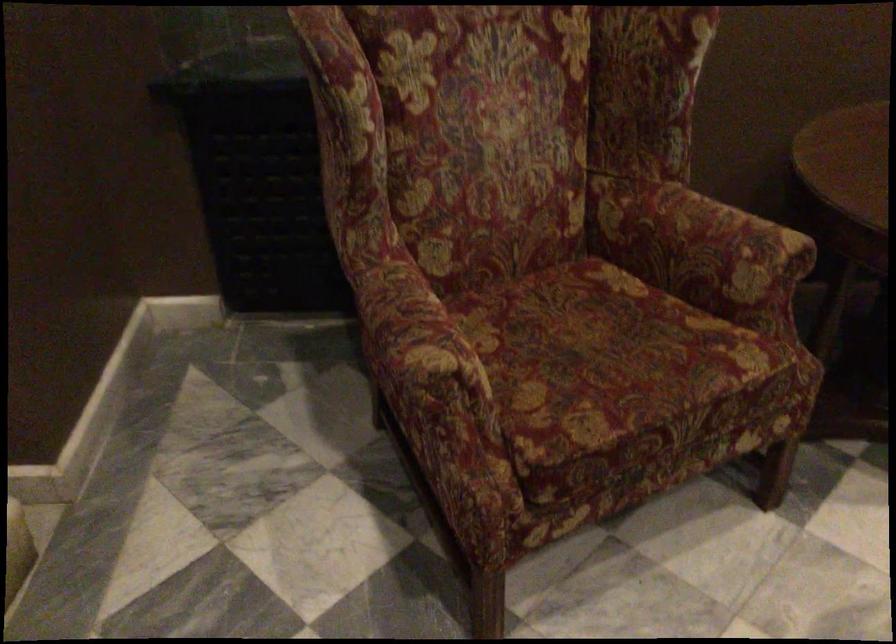
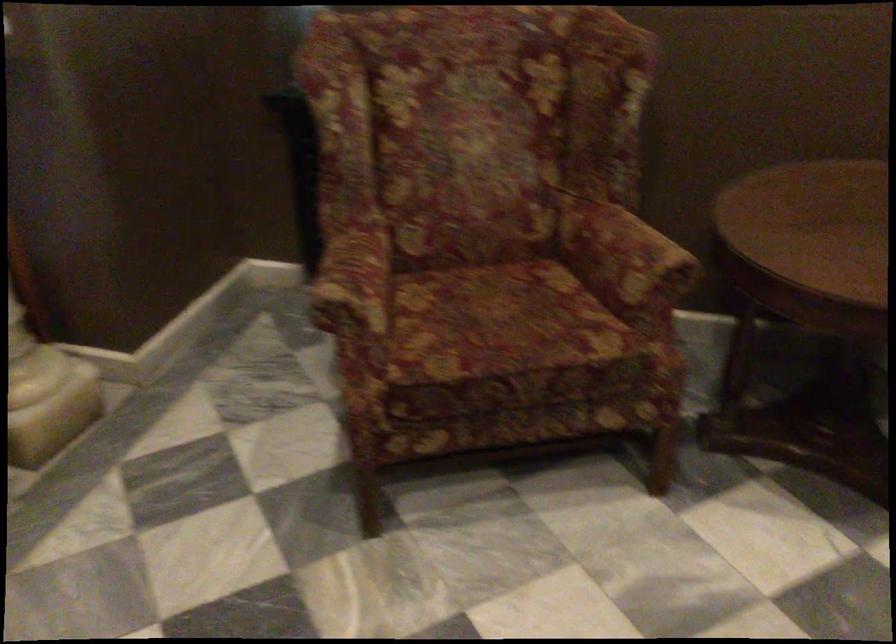
In a continuous first-person perspective shot, in which direction is the camera moving?

The movement direction of the cameraman is right, backward.